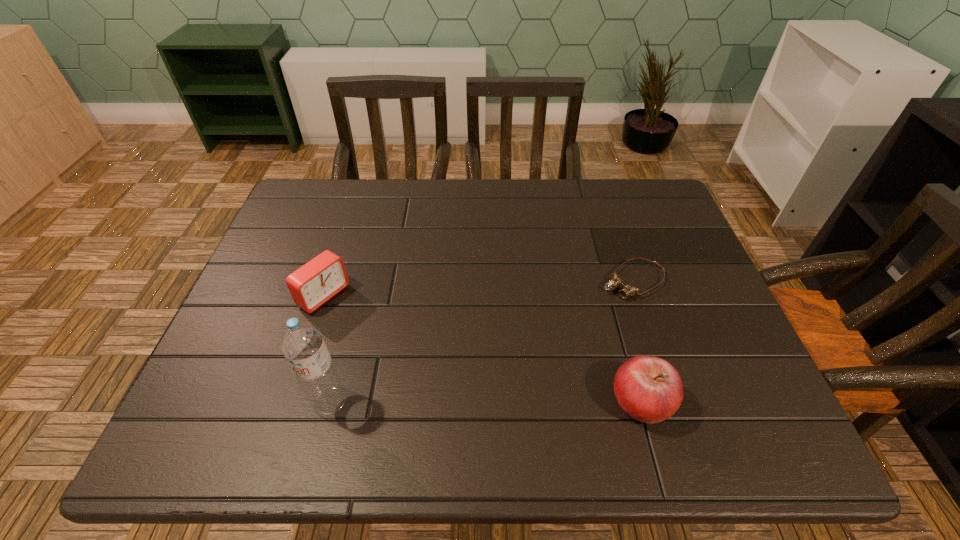
Identify the location of water bottle. (301, 342).

Where is `apple`? apple is located at coordinates (649, 389).

Identify the location of alarm clock. (313, 284).

Locate an element on the screen. The width and height of the screenshot is (960, 540). goggles is located at coordinates (628, 290).

Locate an element on the screen. This screenshot has width=960, height=540. blank space located 0.050m on the right of the tallest object is located at coordinates (372, 401).

Locate an element on the screen. free location located 0.110m on the right of the second tallest object is located at coordinates point(729,401).

Identify the location of vacant space located 0.330m on the front-facing side of the alarm clock. (446, 382).

Where is `vacant space situated 0.310m on the front-facing side of the alarm clock`? The height and width of the screenshot is (540, 960). vacant space situated 0.310m on the front-facing side of the alarm clock is located at coordinates (439, 377).

Where is `blank space located on the front-facing side of the alarm clock`? blank space located on the front-facing side of the alarm clock is located at coordinates (359, 322).

You are a GUI agent. You are given a task and a screenshot of the screen. Output one action in this format:
    pyautogui.click(x=<x>, y=<y>)
    Task: Click on the vacant space located 0.080m on the front lenses and sides of the goggles
    The width and height of the screenshot is (960, 540).
    Given the screenshot: What is the action you would take?
    pyautogui.click(x=588, y=309)